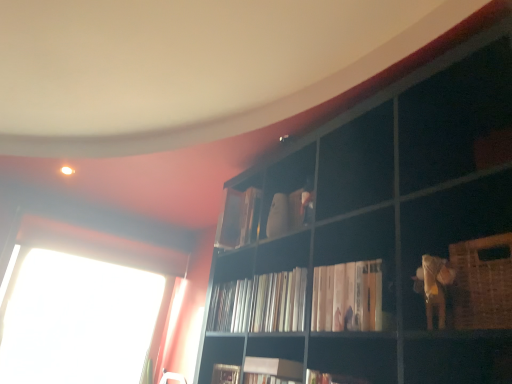
Question: From a real-world perspective, is white matte book at center, which is the first book in front-to-back order, under white glossy books at center?

Choices:
 (A) yes
 (B) no

Answer: (A)

Question: From the image's perspective, is white matte book at center, which is the first book in front-to-back order, above white glossy books at center?

Choices:
 (A) yes
 (B) no

Answer: (A)

Question: Does white matte book at center, which is the first book in front-to-back order, come in front of white glossy books at center?

Choices:
 (A) yes
 (B) no

Answer: (A)

Question: Are white matte book at center, the fourth book viewed from the back, and white glossy books at center making contact?

Choices:
 (A) yes
 (B) no

Answer: (B)

Question: Is white matte book at center, which is the first book in front-to-back order, at the right side of white glossy books at center?

Choices:
 (A) no
 (B) yes

Answer: (B)

Question: Is white glossy books at center wider or thinner than white matte book at center, which is the first book in front-to-back order?

Choices:
 (A) wide
 (B) thin

Answer: (B)

Question: From a real-world perspective, is white glossy books at center positioned above or below white matte book at center, which is the first book in front-to-back order?

Choices:
 (A) below
 (B) above

Answer: (B)

Question: From the image's perspective, is white glossy books at center positioned above or below white matte book at center, the fourth book viewed from the back?

Choices:
 (A) below
 (B) above

Answer: (A)

Question: Relative to white matte book at center, the fourth book viewed from the back, is white glossy books at center in front or behind?

Choices:
 (A) behind
 (B) front

Answer: (A)

Question: In the image, is white glossy books at center positioned in front of or behind woven brown basket at lower right?

Choices:
 (A) front
 (B) behind

Answer: (B)

Question: Considering the relative positions of white glossy books at center and woven brown basket at lower right in the image provided, is white glossy books at center to the left or to the right of woven brown basket at lower right?

Choices:
 (A) right
 (B) left

Answer: (B)

Question: From the image's perspective, is white glossy books at center located above or below woven brown basket at lower right?

Choices:
 (A) above
 (B) below

Answer: (B)

Question: Is white glossy books at center spatially inside woven brown basket at lower right, or outside of it?

Choices:
 (A) inside
 (B) outside

Answer: (B)

Question: Is point (286, 326) closer or farther from the camera than point (227, 193)?

Choices:
 (A) closer
 (B) farther

Answer: (A)

Question: Looking at their shapes, would you say white glossy books at center is wider or thinner than matte white book at upper center, the 4th book when ordered from front to back?

Choices:
 (A) wide
 (B) thin

Answer: (B)